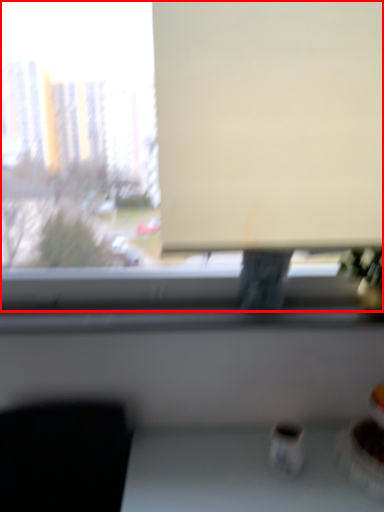
Question: From the image's perspective, considering the relative positions of window (annotated by the red box) and projection screen in the image provided, where is window (annotated by the red box) located with respect to the staircase?

Choices:
 (A) above
 (B) below

Answer: (B)